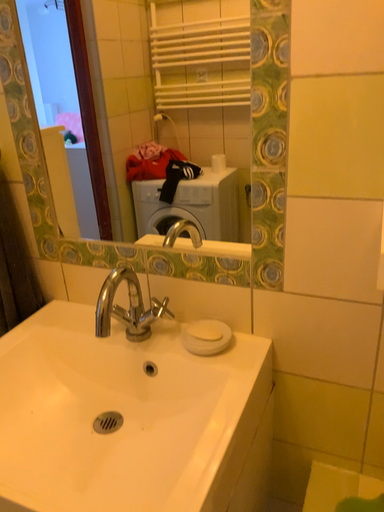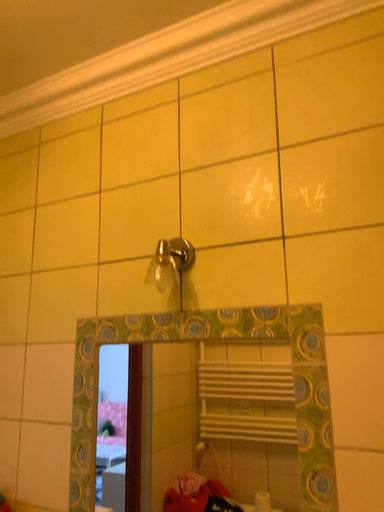
Question: How did the camera likely rotate when shooting the video?

Choices:
 (A) rotated downward
 (B) rotated upward

Answer: (B)